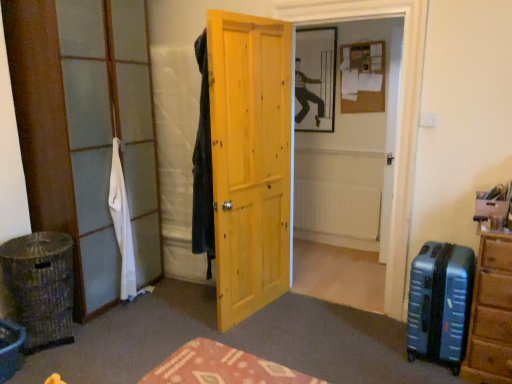
Question: From a real-world perspective, is patterned fabric tablecloth at center beneath brown woven laundry basket at lower left?

Choices:
 (A) no
 (B) yes

Answer: (A)

Question: Can you confirm if patterned fabric tablecloth at center is positioned to the left of brown woven laundry basket at lower left?

Choices:
 (A) yes
 (B) no

Answer: (B)

Question: From the image's perspective, does patterned fabric tablecloth at center appear higher than brown woven laundry basket at lower left?

Choices:
 (A) no
 (B) yes

Answer: (A)

Question: Can we say patterned fabric tablecloth at center lies outside brown woven laundry basket at lower left?

Choices:
 (A) yes
 (B) no

Answer: (A)

Question: Considering the relative sizes of patterned fabric tablecloth at center and brown woven laundry basket at lower left in the image provided, is patterned fabric tablecloth at center bigger than brown woven laundry basket at lower left?

Choices:
 (A) no
 (B) yes

Answer: (A)

Question: Is patterned fabric tablecloth at center not near brown woven laundry basket at lower left?

Choices:
 (A) no
 (B) yes

Answer: (B)

Question: Can you confirm if white fabric at left is positioned to the left of white matte radiator at center?

Choices:
 (A) no
 (B) yes

Answer: (B)

Question: Is white fabric at left outside of white matte radiator at center?

Choices:
 (A) yes
 (B) no

Answer: (A)

Question: Is white matte radiator at center surrounded by white fabric at left?

Choices:
 (A) yes
 (B) no

Answer: (B)

Question: From a real-world perspective, is white fabric at left beneath white matte radiator at center?

Choices:
 (A) yes
 (B) no

Answer: (B)

Question: Is white fabric at left taller than white matte radiator at center?

Choices:
 (A) no
 (B) yes

Answer: (B)

Question: Is white fabric at left smaller than white matte radiator at center?

Choices:
 (A) yes
 (B) no

Answer: (B)

Question: Considering the relative sizes of white fabric at left and clear glass door at left in the image provided, is white fabric at left bigger than clear glass door at left?

Choices:
 (A) yes
 (B) no

Answer: (B)